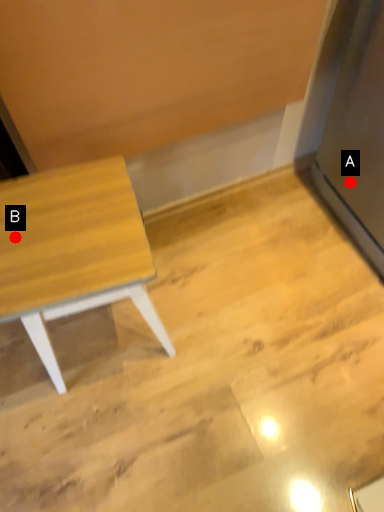
Question: Two points are circled on the image, labeled by A and B beside each circle. Which point is farther to the camera?

Choices:
 (A) A is further
 (B) B is further

Answer: (A)